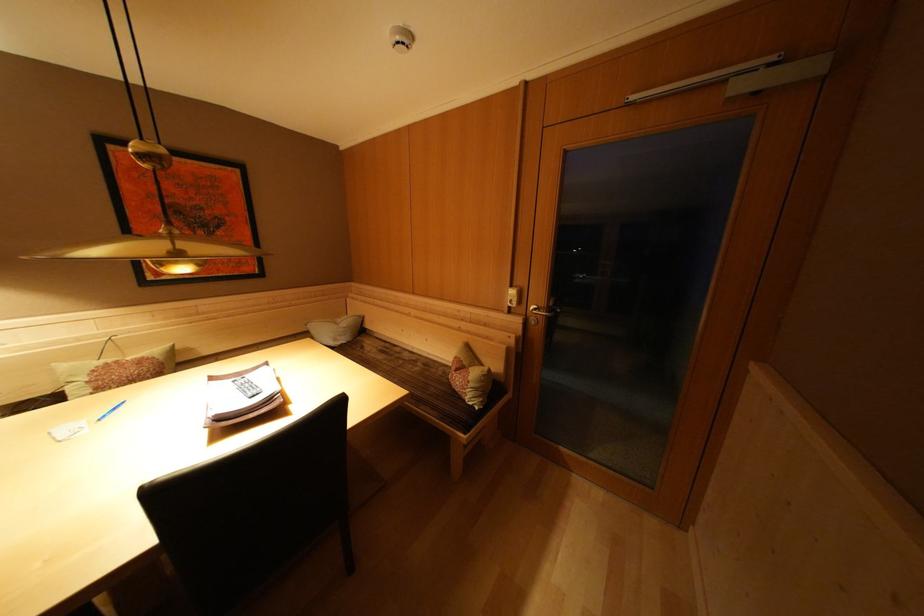
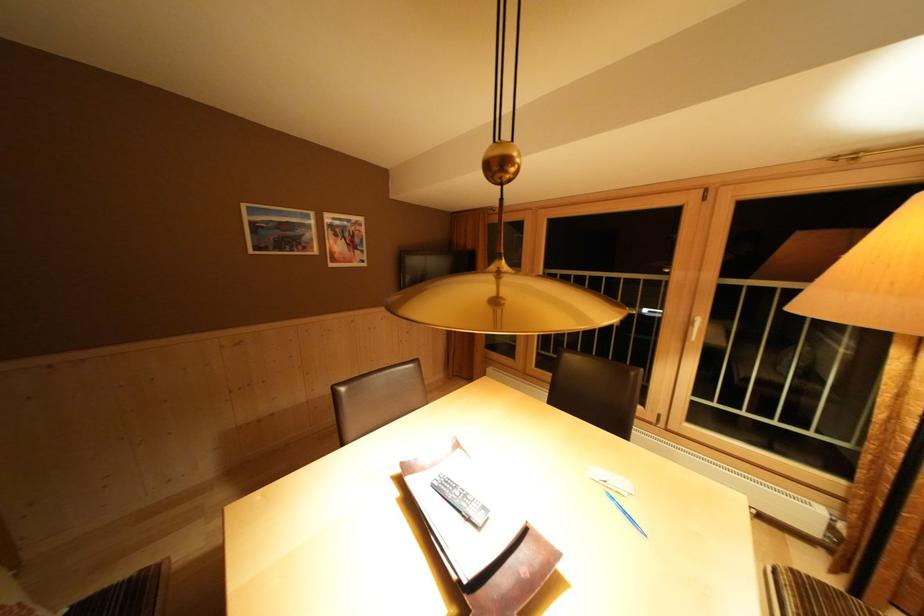
The point at (120, 415) is marked in the first image. Where is the corresponding point in the second image?

(633, 517)